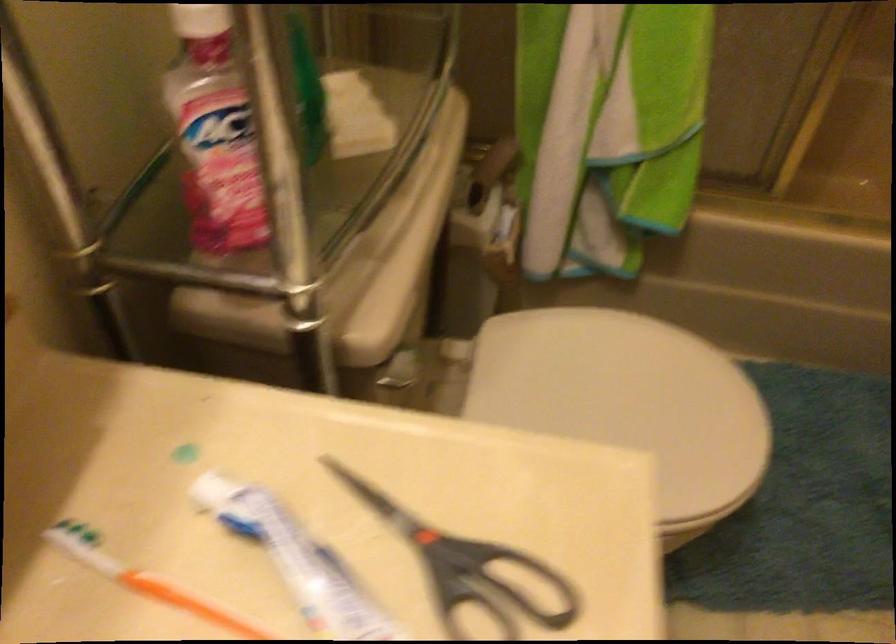
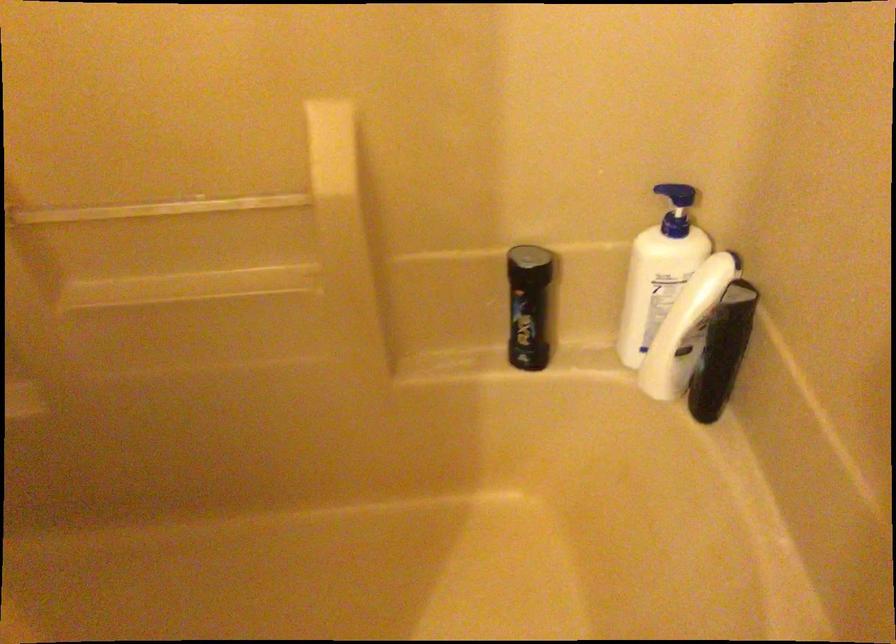
What movement of the cameraman would produce the second image?

The movement direction of the cameraman is right, forward.